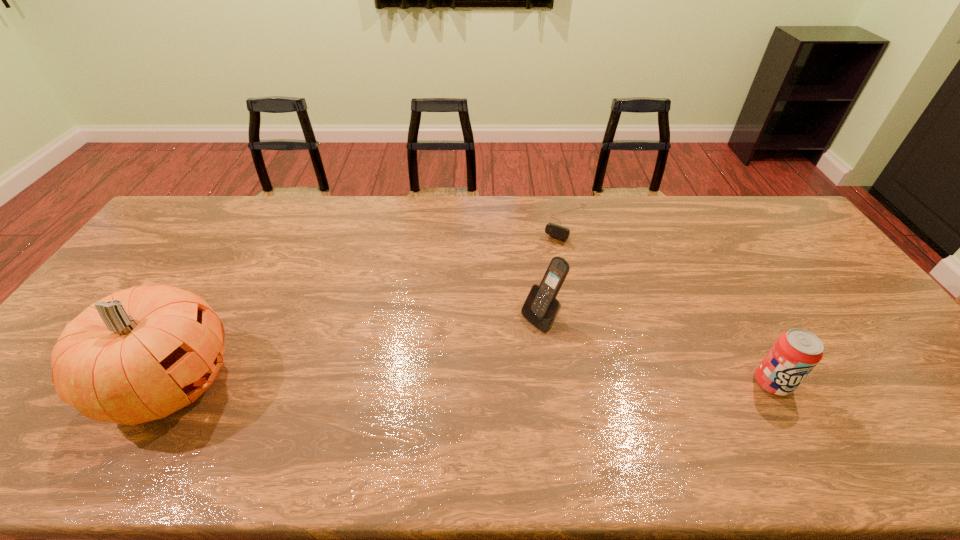
Locate an element on the screen. The image size is (960, 540). free space at the far right corner of the desktop is located at coordinates (758, 215).

This screenshot has height=540, width=960. Find the location of `vacant position at the near right corner of the desktop`. vacant position at the near right corner of the desktop is located at coordinates [x=929, y=388].

Where is `free space between the webcam and the second shortest object`? The height and width of the screenshot is (540, 960). free space between the webcam and the second shortest object is located at coordinates (669, 303).

This screenshot has width=960, height=540. What are the coordinates of `vacant area that lies between the farthest object and the pumpkin` in the screenshot? It's located at (369, 303).

The width and height of the screenshot is (960, 540). I want to click on vacant area between the shortest object and the soda can, so (x=669, y=303).

Find the location of `blank region between the leftmost object and the rightmost object`. blank region between the leftmost object and the rightmost object is located at coordinates (471, 383).

I want to click on empty space between the webcam and the leftmost object, so 369,303.

Locate an element on the screen. The width and height of the screenshot is (960, 540). free space between the leftmost object and the farthest object is located at coordinates (369, 303).

Identify the location of unoccupied position between the tallest object and the webcam. The image size is (960, 540). (369, 303).

Find the location of `the third closest object to the cellular telephone`. the third closest object to the cellular telephone is located at coordinates (140, 354).